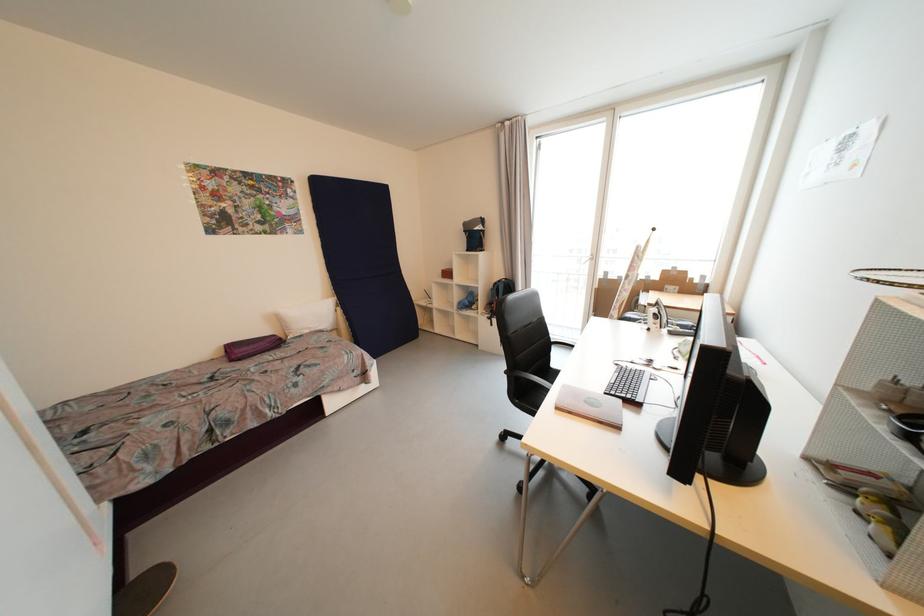
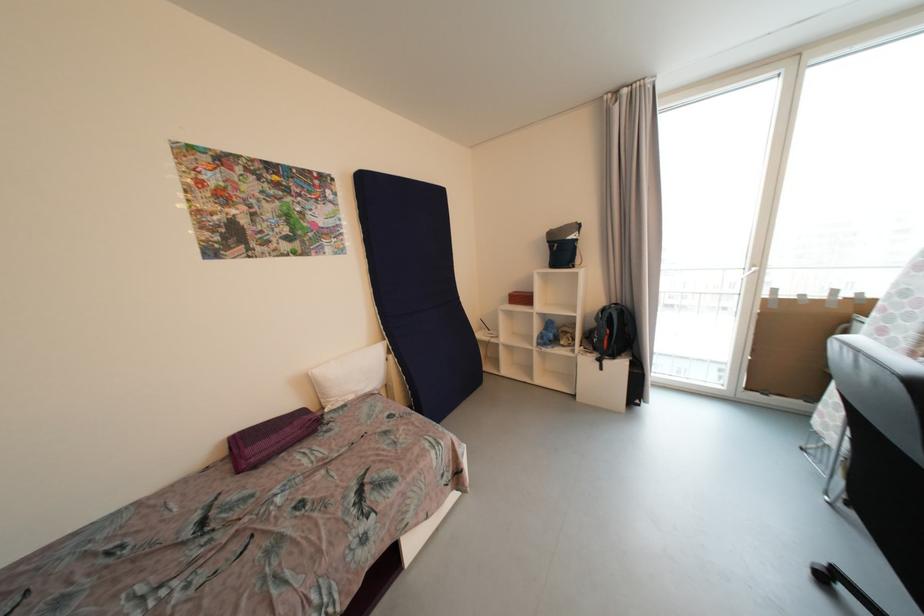
The point at (344, 310) is marked in the first image. Where is the corresponding point in the second image?

(396, 359)